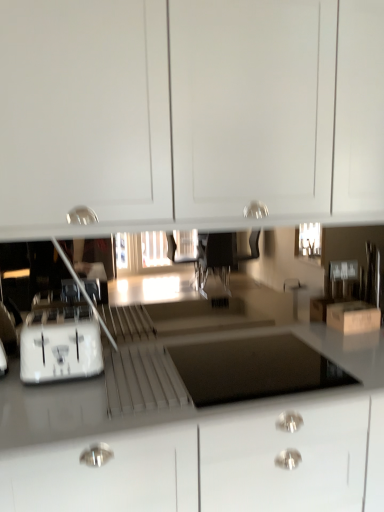
What are the coordinates of `white glossy countertop at lower center` in the screenshot? It's located at (101, 406).

What do you see at coordinates (101, 406) in the screenshot?
I see `white glossy countertop at lower center` at bounding box center [101, 406].

The width and height of the screenshot is (384, 512). In order to click on white plastic drawer at center in this screenshot , I will do `click(253, 369)`.

You are a GUI agent. You are given a task and a screenshot of the screen. Output one action in this format:
    pyautogui.click(x=<x>, y=<y>)
    Task: Click on the brown cardboard box at lower right
    This screenshot has width=384, height=512.
    Given the screenshot: What is the action you would take?
    pyautogui.click(x=353, y=317)

Does point (203, 99) come farther from viewer compared to point (115, 383)?

No.

Is the depth of white glossy cabinet at upper center less than that of white glossy countertop at lower center?

No, it is behind white glossy countertop at lower center.

Is white glossy cabinet at upper center surrounding white glossy countertop at lower center?

That's incorrect, white glossy countertop at lower center is not inside white glossy cabinet at upper center.

Considering the relative sizes of white glossy cabinet at upper center and white glossy countertop at lower center in the image provided, is white glossy cabinet at upper center wider than white glossy countertop at lower center?

No, white glossy cabinet at upper center is not wider than white glossy countertop at lower center.

Is the depth of white plastic drawer at center greater than that of white glossy countertop at lower center?

Yes.

In the scene shown: Can you confirm if white plastic drawer at center is thinner than white glossy countertop at lower center?

Indeed, white plastic drawer at center has a lesser width compared to white glossy countertop at lower center.

Find the location of a particular element. counter top on the right of white plastic drawer at center is located at coordinates (101, 406).

In the image, is white plastic drawer at center on the left side or the right side of white glossy countertop at lower center?

Based on their positions, white plastic drawer at center is located to the left of white glossy countertop at lower center.

From a real-world perspective, is white plastic toaster at lower left on white plastic drawer at center?

Yes, from a real-world perspective, white plastic toaster at lower left is above white plastic drawer at center.

Is white plastic toaster at lower left to the left or to the right of white plastic drawer at center in the image?

white plastic toaster at lower left is positioned on white plastic drawer at center's left side.

Find the location of a particular element. appliance in front of the white plastic toaster at lower left is located at coordinates (253, 369).

Who is bigger, white plastic drawer at center or white glossy cabinet at upper center?

white glossy cabinet at upper center.

From a real-world perspective, who is located higher, white plastic drawer at center or white glossy cabinet at upper center?

white glossy cabinet at upper center, from a real-world perspective.

Considering the sizes of white plastic drawer at center and white glossy cabinet at upper center in the image, is white plastic drawer at center taller or shorter than white glossy cabinet at upper center?

Clearly, white plastic drawer at center is shorter compared to white glossy cabinet at upper center.

From a real-world perspective, is white plastic drawer at center physically located above or below brown cardboard box at lower right?

From a real-world perspective, white plastic drawer at center is physically below brown cardboard box at lower right.

Is white plastic drawer at center spatially inside brown cardboard box at lower right, or outside of it?

white plastic drawer at center is not enclosed by brown cardboard box at lower right.

In the scene shown: From the image's perspective, is white plastic drawer at center located above or below brown cardboard box at lower right?

white plastic drawer at center is situated lower than brown cardboard box at lower right in the image.

Is white plastic drawer at center turned away from brown cardboard box at lower right?

white plastic drawer at center does not have its back to brown cardboard box at lower right.

Which is in front, brown cardboard box at lower right or white glossy countertop at lower center?

white glossy countertop at lower center is more forward.

From the picture: From a real-world perspective, which object rests below the other?

white glossy countertop at lower center, from a real-world perspective.

Is brown cardboard box at lower right oriented towards white glossy countertop at lower center?

No, brown cardboard box at lower right is not aimed at white glossy countertop at lower center.

Considering the positions of objects brown cardboard box at lower right and white plastic drawer at center in the image provided, who is in front, brown cardboard box at lower right or white plastic drawer at center?

white plastic drawer at center is closer to the camera.

Does brown cardboard box at lower right turn towards white plastic drawer at center?

No, brown cardboard box at lower right is not facing towards white plastic drawer at center.

At what (x,y) coordinates should I click in order to perform the action: click on appliance that is under the brown cardboard box at lower right (from a real-world perspective). Please return your answer as a coordinate pair (x, y). Looking at the image, I should click on (253, 369).

Can white plastic drawer at center be found inside brown cardboard box at lower right?

No, white plastic drawer at center is located outside of brown cardboard box at lower right.

At what (x,y) coordinates should I click in order to perform the action: click on cabinetry above the white glossy countertop at lower center (from the image's perspective). Please return your answer as a coordinate pair (x, y). This screenshot has height=512, width=384. Looking at the image, I should click on (189, 108).

The height and width of the screenshot is (512, 384). In order to click on counter top in front of the white plastic drawer at center in this screenshot , I will do pyautogui.click(x=101, y=406).

Which object lies nearer to the anchor point white glossy cabinet at upper center, white plastic drawer at center or white glossy countertop at lower center?

white plastic drawer at center is closer to white glossy cabinet at upper center.

Looking at the image, which one is located further to white plastic toaster at lower left, white glossy countertop at lower center or white plastic drawer at center?

Among the two, white plastic drawer at center is located further to white plastic toaster at lower left.

Based on their spatial positions, is white plastic toaster at lower left or white glossy cabinet at upper center closer to brown cardboard box at lower right?

white glossy cabinet at upper center is positioned closer to the anchor brown cardboard box at lower right.

From the image, which object appears to be farther from white plastic drawer at center, brown cardboard box at lower right or white plastic toaster at lower left?

Based on the image, brown cardboard box at lower right appears to be further to white plastic drawer at center.

Based on the photo, considering their positions, is white plastic toaster at lower left positioned closer to white glossy countertop at lower center than white glossy cabinet at upper center?

white plastic toaster at lower left is closer to white glossy countertop at lower center.

Estimate the real-world distances between objects in this image. Which object is further from white plastic drawer at center, white plastic toaster at lower left or white glossy cabinet at upper center?

Among the two, white glossy cabinet at upper center is located further to white plastic drawer at center.

Based on their spatial positions, is brown cardboard box at lower right or white plastic toaster at lower left closer to white glossy cabinet at upper center?

white plastic toaster at lower left.

From the image, which object appears to be farther from white glossy cabinet at upper center, white plastic toaster at lower left or white plastic drawer at center?

Among the two, white plastic drawer at center is located further to white glossy cabinet at upper center.

Find the location of a particular element. This screenshot has width=384, height=512. home appliance that lies between white glossy cabinet at upper center and white plastic drawer at center from top to bottom is located at coordinates coord(60,345).

Locate an element on the screen. Image resolution: width=384 pixels, height=512 pixels. appliance between white glossy cabinet at upper center and white glossy countertop at lower center vertically is located at coordinates (253, 369).

Image resolution: width=384 pixels, height=512 pixels. In order to click on appliance between white glossy countertop at lower center and brown cardboard box at lower right from front to back in this screenshot , I will do `click(253, 369)`.

At what (x,y) coordinates should I click in order to perform the action: click on cardboard box between white glossy cabinet at upper center and white glossy countertop at lower center vertically. Please return your answer as a coordinate pair (x, y). The image size is (384, 512). Looking at the image, I should click on 353,317.